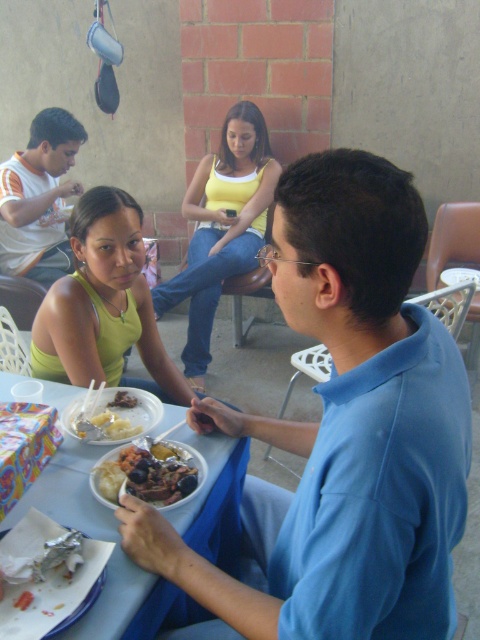
Question: Which point is closer to the camera taking this photo?

Choices:
 (A) (57, 368)
 (B) (10, 186)

Answer: (A)

Question: Which object is farther from the camera taking this photo?

Choices:
 (A) white glossy bowl at center
 (B) matte yellow tank top at center

Answer: (B)

Question: Is matte yellow tank top at center bigger than yellow cotton tank top at center?

Choices:
 (A) no
 (B) yes

Answer: (A)

Question: Considering the real-world distances, which object is farthest from the blue smooth shirt at center?

Choices:
 (A) matte yellow tank top at center
 (B) yellow cotton tank top at center

Answer: (B)

Question: Can you confirm if white-orange t-shirt at left is positioned to the left of shiny metallic bowl at center?

Choices:
 (A) no
 (B) yes

Answer: (B)

Question: Can you confirm if white plastic table at lower center is positioned to the left of shiny metallic bowl at center?

Choices:
 (A) no
 (B) yes

Answer: (B)